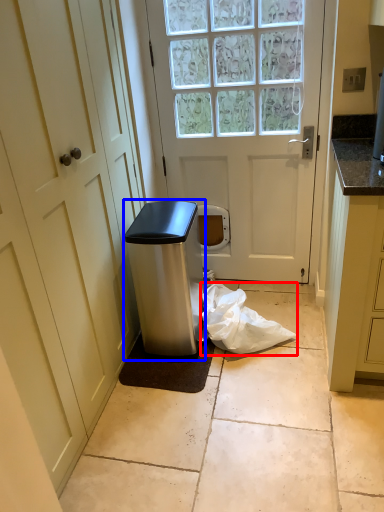
Question: Among these objects, which one is farthest to the camera, plastic bag (highlighted by a red box) or appliance (highlighted by a blue box)?

Choices:
 (A) plastic bag
 (B) appliance

Answer: (A)